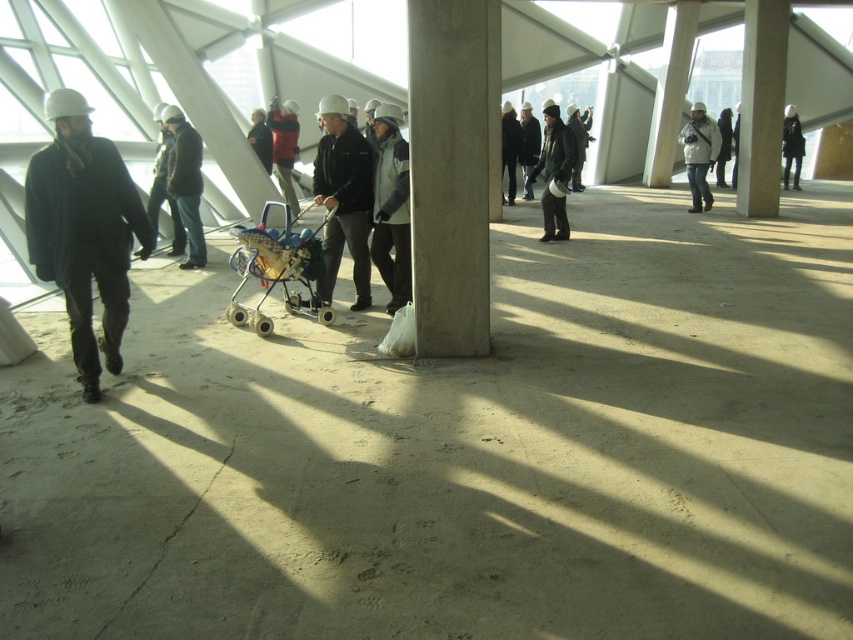
Question: Does blue plastic baby carriage at center appear under dark gray jacket at center?

Choices:
 (A) no
 (B) yes

Answer: (B)

Question: Is dark gray jacket at center above white knit hat at center?

Choices:
 (A) no
 (B) yes

Answer: (A)

Question: Considering the real-world distances, which object is farthest from the matte black jacket at left?

Choices:
 (A) white knit hat at center
 (B) blue plastic baby carriage at center

Answer: (A)

Question: Is dark gray jacket at center closer to camera compared to dark gray knit hat at center?

Choices:
 (A) no
 (B) yes

Answer: (B)

Question: Which point is farther to the camera?

Choices:
 (A) matte black jacket at center
 (B) white textured jacket at center
 (C) blue plastic baby carriage at center

Answer: (B)

Question: Which object is farther from the camera taking this photo?

Choices:
 (A) matte black jacket at left
 (B) white textured jacket at center

Answer: (B)